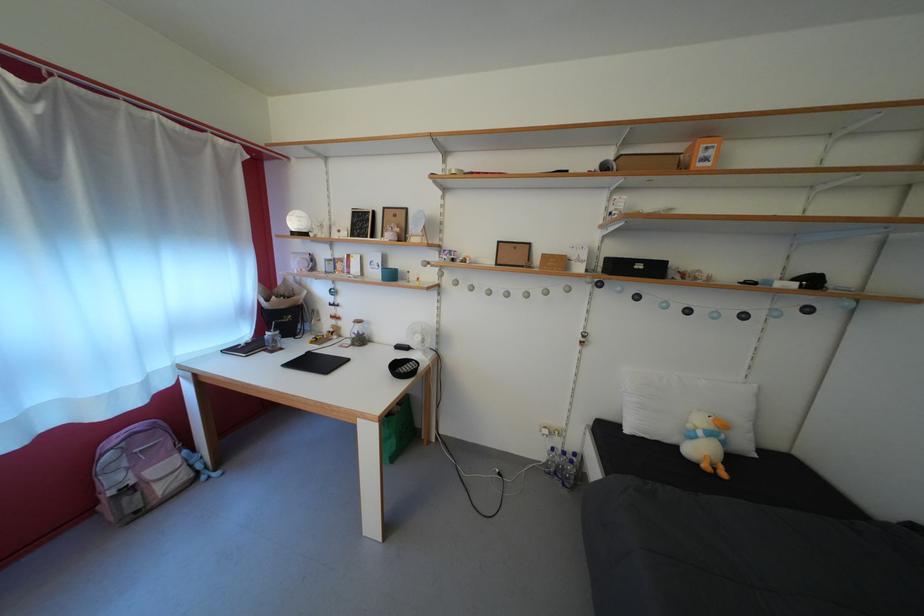
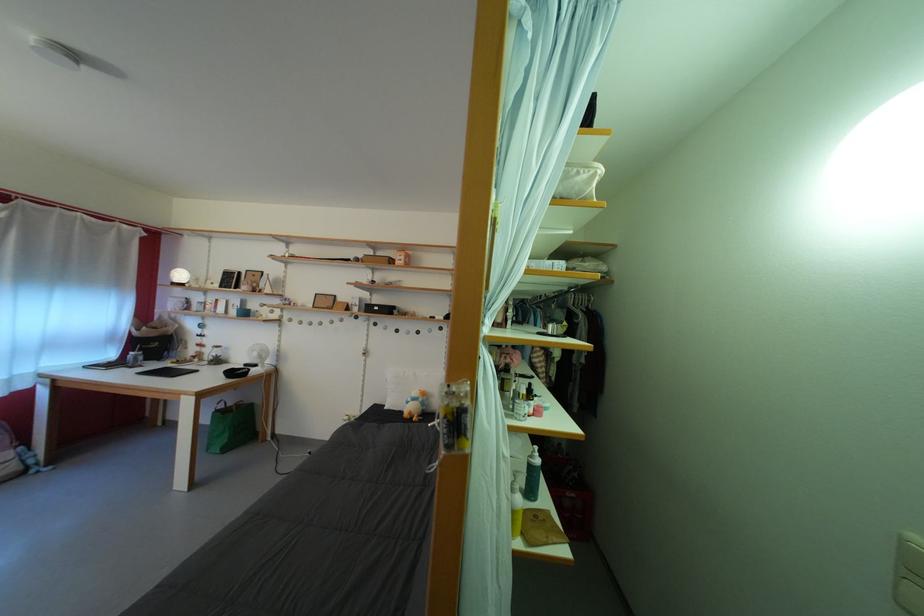
Find the pixel in the second image that matches [427,344] in the first image.

(263, 360)